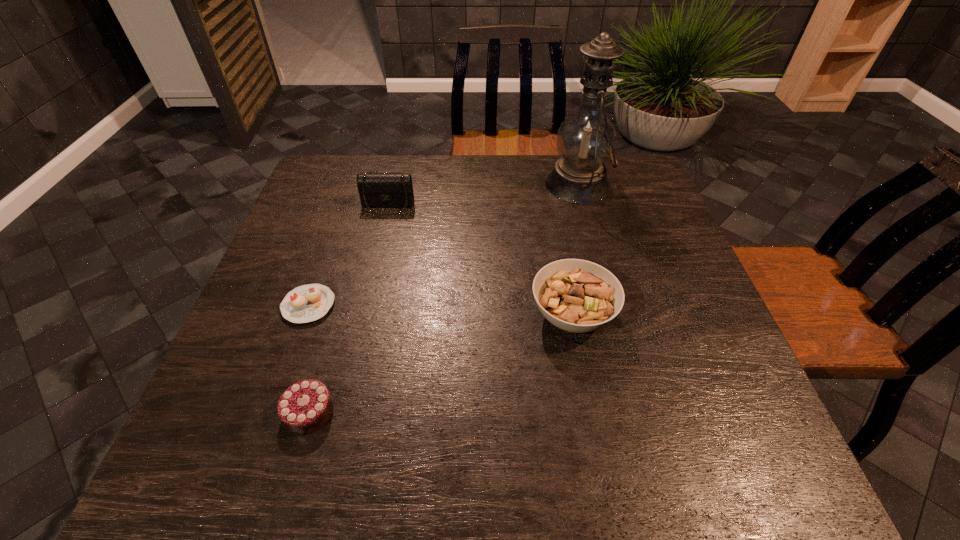
This screenshot has width=960, height=540. What are the coordinates of `free space located 0.290m on the front of the cupcake` in the screenshot? It's located at (252, 462).

In order to click on oil lamp situated at the far edge in this screenshot , I will do `click(586, 139)`.

I want to click on clutch bag located at the far edge, so click(x=377, y=190).

The image size is (960, 540). In order to click on object present at the near edge in this screenshot , I will do `click(306, 406)`.

Identify the location of chocolate cake at the left edge. (306, 406).

What are the coordinates of `cupcake present at the left edge` in the screenshot? It's located at (306, 303).

The image size is (960, 540). I want to click on object that is at the right edge, so click(586, 139).

You are a GUI agent. You are given a task and a screenshot of the screen. Output one action in this format:
    pyautogui.click(x=<x>, y=<y>)
    Task: Click on the object situated at the near left corner
    Image resolution: width=960 pixels, height=540 pixels.
    Given the screenshot: What is the action you would take?
    pyautogui.click(x=306, y=406)

At what (x,y) coordinates should I click in order to perform the action: click on object that is at the far right corner. Please return your answer as a coordinate pair (x, y). The width and height of the screenshot is (960, 540). Looking at the image, I should click on (586, 139).

In the image, there is a desktop. Where is `vacant space at the far edge`? vacant space at the far edge is located at coordinates (516, 176).